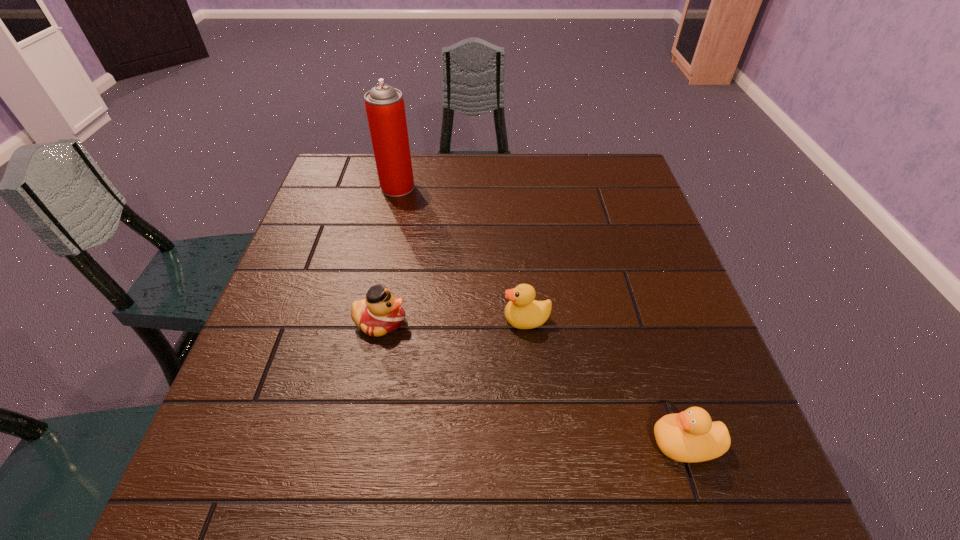
You are a GUI agent. You are given a task and a screenshot of the screen. Output one action in this format:
    pyautogui.click(x=<x>, y=<y>)
    Task: Click on the free spot between the rightmost duck and the leftmost duck
    
    Given the screenshot: What is the action you would take?
    pyautogui.click(x=533, y=382)

Locate an element on the screen. object that ranks as the closest to the third object from left to right is located at coordinates (381, 312).

Where is `the third closest object to the leftmost duck`? the third closest object to the leftmost duck is located at coordinates (690, 436).

Image resolution: width=960 pixels, height=540 pixels. Find the location of `duck object that ranks as the closest to the leftmost duck`. duck object that ranks as the closest to the leftmost duck is located at coordinates (523, 312).

Identify the location of the second closest duck to the leftmost duck. (690, 436).